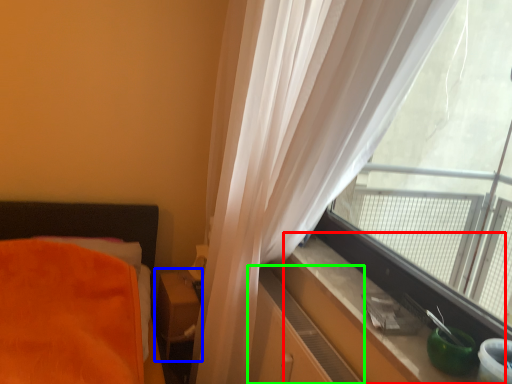
Question: Which object is the farthest from window sill (highlighted by a red box)? Choose among these: table (highlighted by a blue box) or dresser (highlighted by a green box).

Choices:
 (A) table
 (B) dresser

Answer: (A)